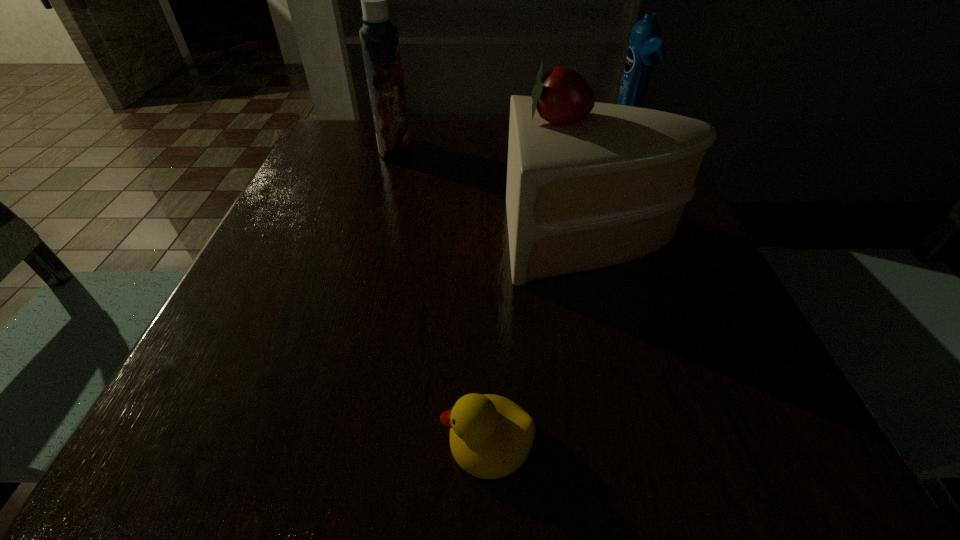
Locate an element on the screen. the smallest gold watch is located at coordinates (273, 383).

Image resolution: width=960 pixels, height=540 pixels. In order to click on the nearest gray watch in this screenshot , I will do (739, 433).

Locate an element on the screen. The width and height of the screenshot is (960, 540). vacant space located on the face of the sunflower is located at coordinates (353, 188).

This screenshot has width=960, height=540. I want to click on vacant space located 0.290m on the left of the eighth nearest object, so click(470, 168).

Locate an element on the screen. This screenshot has width=960, height=540. vacant space located on the face of the biggest gold watch is located at coordinates (447, 209).

Locate an element on the screen. vacant space located 0.390m on the face of the farthest gray watch is located at coordinates tap(261, 235).

You are a GUI agent. You are given a task and a screenshot of the screen. Output one action in this format:
    pyautogui.click(x=<x>, y=<y>)
    Task: Click on the free region located 0.380m on the face of the farthest gray watch
    This screenshot has height=540, width=960.
    Given the screenshot: What is the action you would take?
    pyautogui.click(x=267, y=235)

In order to click on free spot located on the face of the farthest gray watch in this screenshot , I will do `click(277, 235)`.

This screenshot has width=960, height=540. Identify the location of free region located 0.320m on the back of the candle holder. (380, 176).

Find the location of a particular element. free space located 0.240m on the face of the second farthest gray watch is located at coordinates (501, 283).